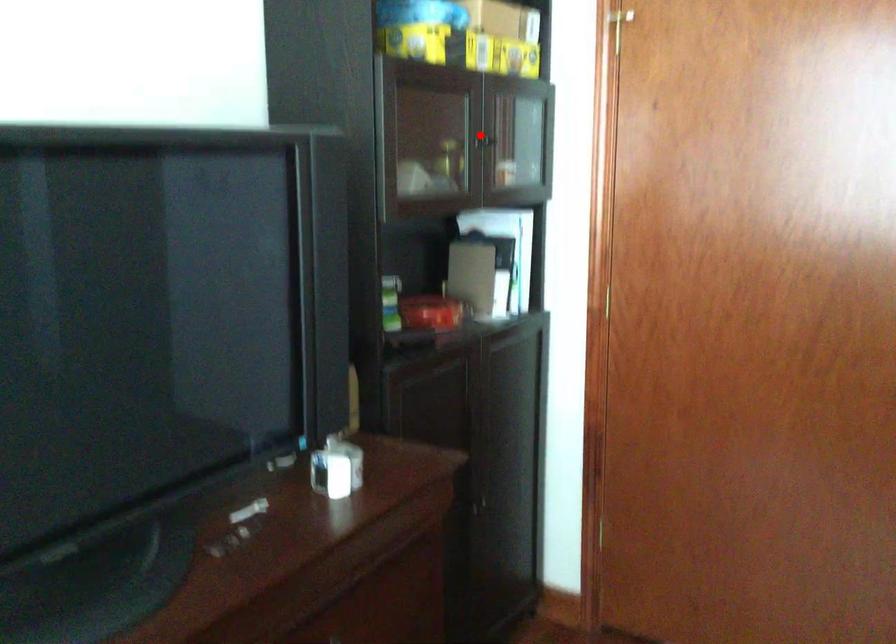
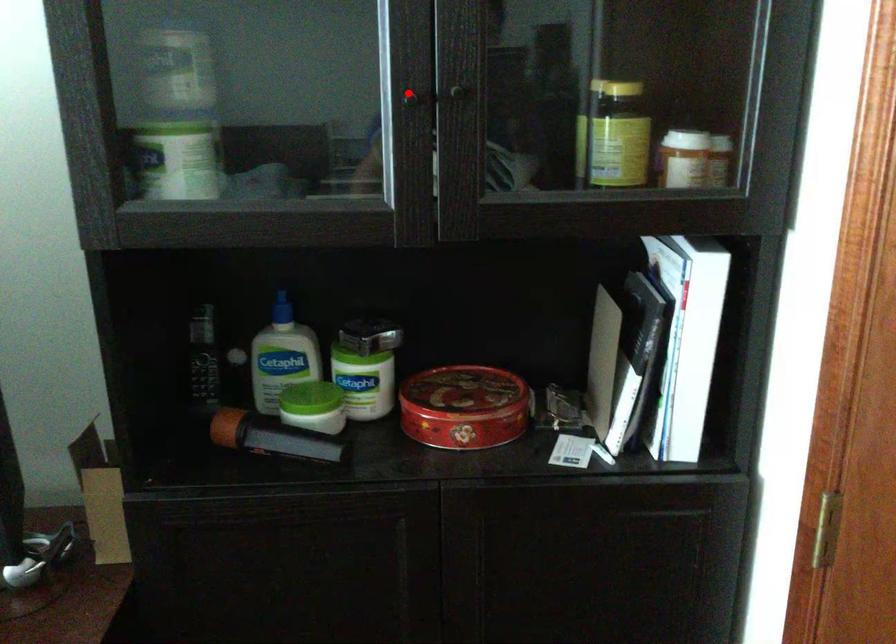
I am providing you with two images of the same scene from different viewpoints. A red point is marked on the first image and another point is marked on the second image. Are the points marked in image1 and image2 representing the same 3D position?

Yes